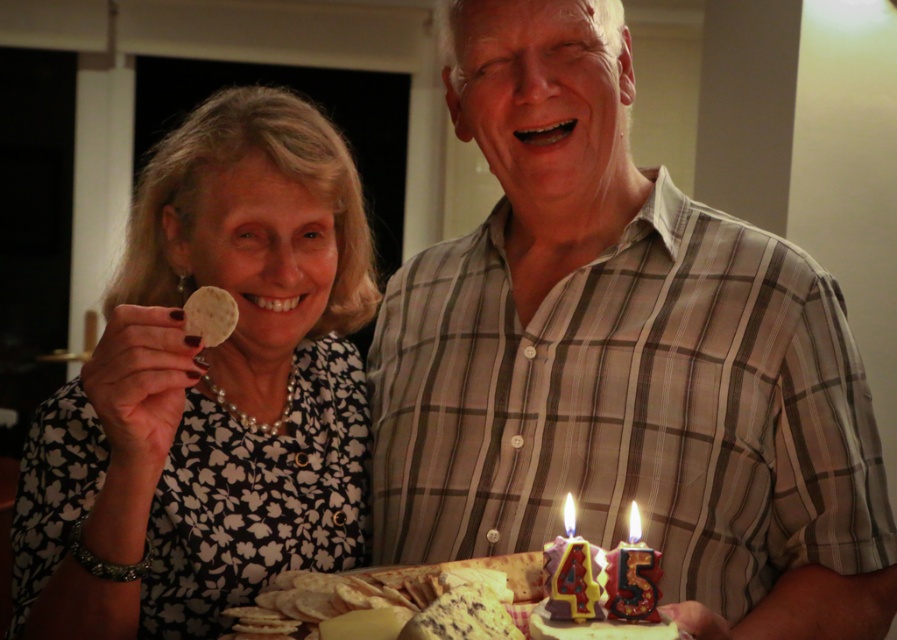
You are a photographer setting up for a birthday photo shoot. You need to ensure that the plaid shirt at center and the yellow waxy candle at center are both visible in the frame. Based on their positions, which object should you focus on first to capture both in the shot?

The plaid shirt at center is located above the yellow waxy candle at center, so focusing on the plaid shirt at center first will ensure both are in the frame as the candle is below it.

You are a photographer setting up for a birthday photo shoot. You have a matte plastic candle at center and a plaid shirt at center in the scene. The camera you are using has a focal length of 50mm. To ensure both objects are in focus, what minimum distance should you maintain between the camera and the scene?

The plaid shirt at center and matte plastic candle at center are 13.17 inches apart. With a 50mm focal length, the minimum distance required to keep both objects in focus would be calculated using the hyperfocal distance formula. However, for simplicity, maintaining a distance of at least 10 feet from the scene should ensure both are in focus given the separation between them.